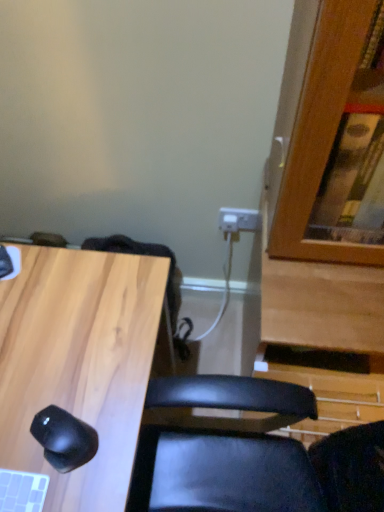
Question: Considering the relative sizes of black matte mouse at lower left and light wood/black mouse at lower left in the image provided, is black matte mouse at lower left taller than light wood/black mouse at lower left?

Choices:
 (A) no
 (B) yes

Answer: (A)

Question: Would you say black matte mouse at lower left is a long distance from light wood/black mouse at lower left?

Choices:
 (A) no
 (B) yes

Answer: (A)

Question: Is black matte mouse at lower left in contact with light wood/black mouse at lower left?

Choices:
 (A) yes
 (B) no

Answer: (B)

Question: From a real-world perspective, is black matte mouse at lower left under light wood/black mouse at lower left?

Choices:
 (A) no
 (B) yes

Answer: (A)

Question: From a real-world perspective, is black matte mouse at lower left positioned over light wood/black mouse at lower left based on gravity?

Choices:
 (A) no
 (B) yes

Answer: (B)

Question: Can light wood/black mouse at lower left be found inside black matte mouse at lower left?

Choices:
 (A) no
 (B) yes

Answer: (A)

Question: Does light wood/black mouse at lower left appear on the right side of black matte mouse at lower left?

Choices:
 (A) yes
 (B) no

Answer: (B)

Question: Can we say light wood/black mouse at lower left lies outside black matte mouse at lower left?

Choices:
 (A) no
 (B) yes

Answer: (B)

Question: Would you consider light wood/black mouse at lower left to be distant from black matte mouse at lower left?

Choices:
 (A) no
 (B) yes

Answer: (A)

Question: From a real-world perspective, is light wood/black mouse at lower left positioned under black matte mouse at lower left based on gravity?

Choices:
 (A) yes
 (B) no

Answer: (A)

Question: Is light wood/black mouse at lower left further to the viewer compared to black matte mouse at lower left?

Choices:
 (A) no
 (B) yes

Answer: (A)

Question: Is light wood/black mouse at lower left wider than black matte mouse at lower left?

Choices:
 (A) no
 (B) yes

Answer: (B)

Question: Relative to light wood/black mouse at lower left, is black matte mouse at lower left in front or behind?

Choices:
 (A) front
 (B) behind

Answer: (B)